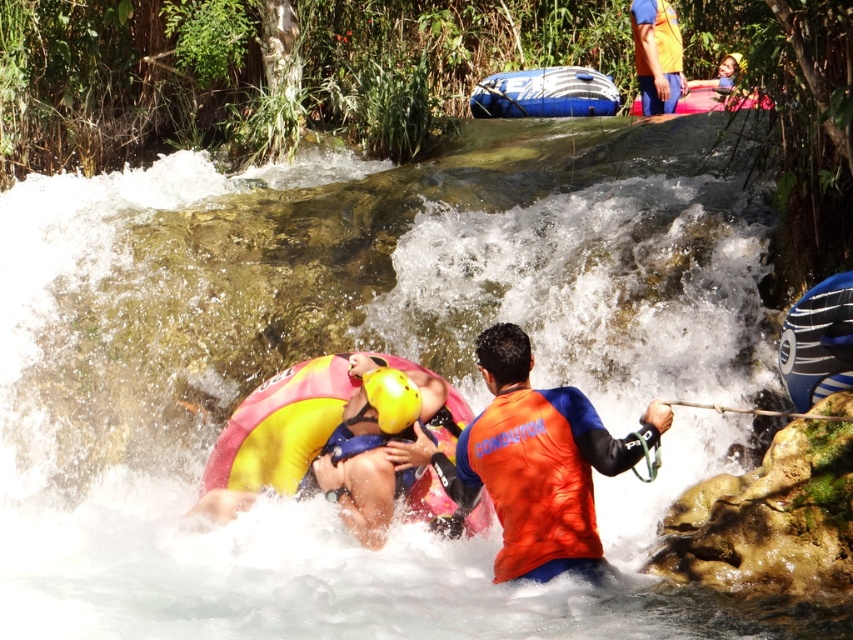
Question: Is orange matte life jacket at center above yellow matte life jacket at center?

Choices:
 (A) yes
 (B) no

Answer: (B)

Question: Is yellow matte life jacket at center thinner than orange fabric jacket at upper center?

Choices:
 (A) no
 (B) yes

Answer: (A)

Question: Which point is closer to the camera taking this photo?

Choices:
 (A) (572, 452)
 (B) (525, 508)

Answer: (A)

Question: Which point is farther from the camera taking this photo?

Choices:
 (A) (428, 374)
 (B) (541, 83)
 (C) (521, 410)

Answer: (B)

Question: Which object appears farthest from the camera in this image?

Choices:
 (A) blue rubber raft at upper center
 (B) yellow matte helmet at center
 (C) pink rubber raft at upper center

Answer: (A)

Question: Can you confirm if orange matte life jacket at center is wider than blue rubber raft at upper center?

Choices:
 (A) no
 (B) yes

Answer: (A)